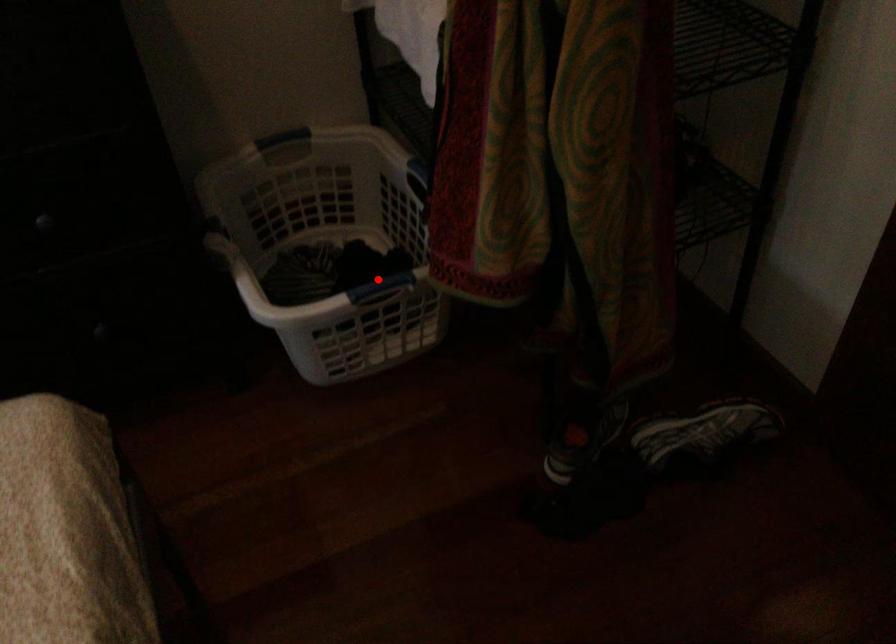
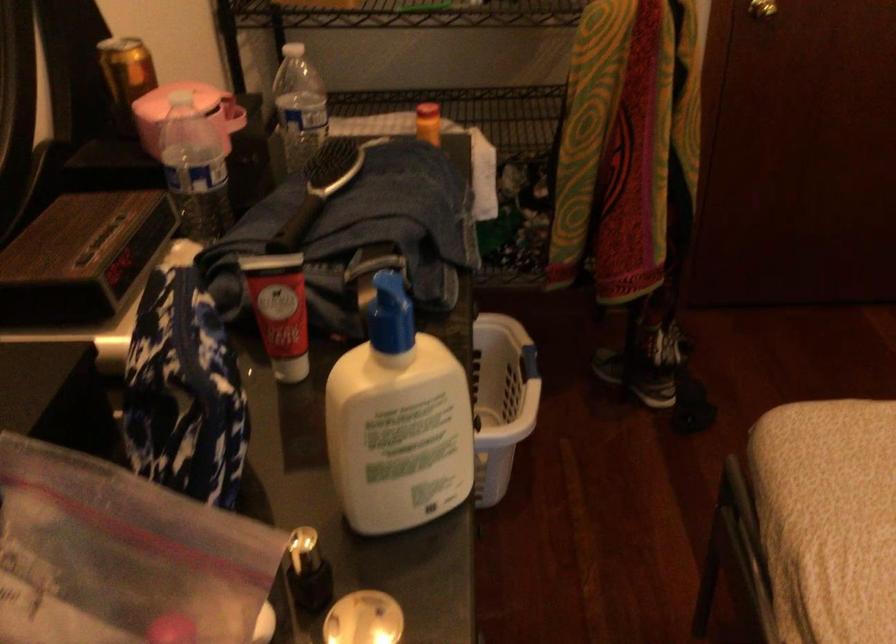
Question: I am providing you with two images of the same scene from different viewpoints. A red point is marked on the first image. Is the red point's position out of view in image 2?

Choices:
 (A) Yes
 (B) No

Answer: (B)